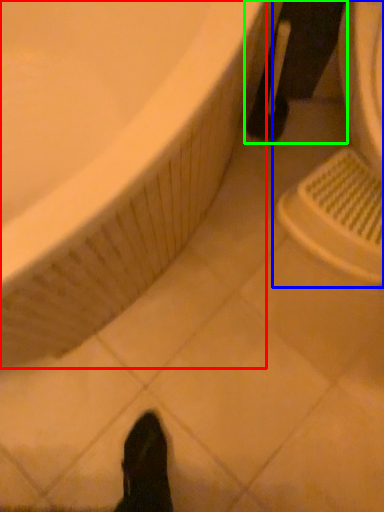
Question: Which object is the farthest from bathtub (highlighted by a red box)? Choose among these: sink (highlighted by a blue box) or leg (highlighted by a green box).

Choices:
 (A) sink
 (B) leg

Answer: (B)